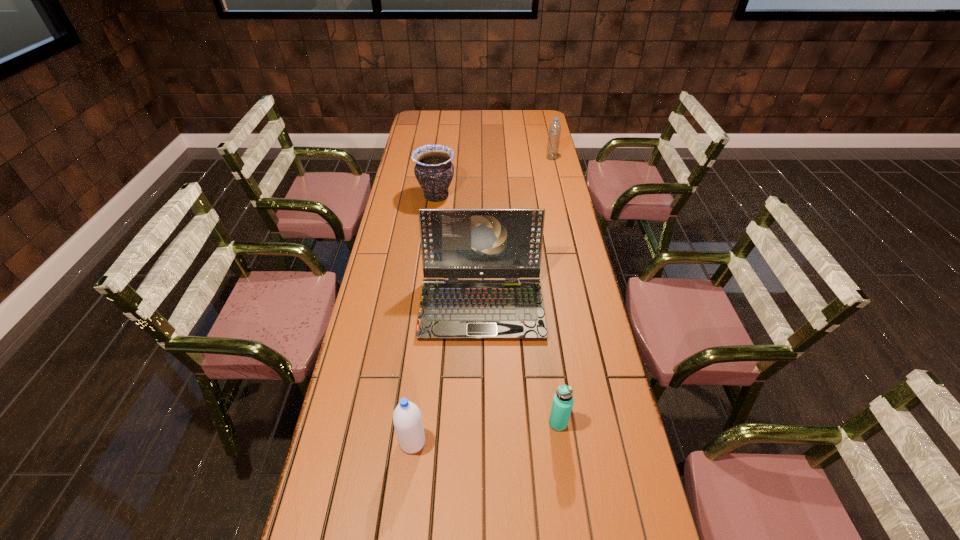
What are the coordinates of `vacant space located on the front handle of the pottery` in the screenshot? It's located at (534, 195).

You are a GUI agent. You are given a task and a screenshot of the screen. Output one action in this format:
    pyautogui.click(x=<x>, y=<y>)
    Task: Click on the vacant space located 0.240m on the right of the leftmost water bottle
    
    Given the screenshot: What is the action you would take?
    pyautogui.click(x=522, y=442)

Where is `free space located on the left of the shortest water bottle`? free space located on the left of the shortest water bottle is located at coordinates (483, 423).

Where is `object at the left edge`? object at the left edge is located at coordinates (434, 171).

Locate an element on the screen. The width and height of the screenshot is (960, 540). vacant area at the far edge of the desktop is located at coordinates (492, 129).

Where is `vacant space at the left edge of the desktop`? Image resolution: width=960 pixels, height=540 pixels. vacant space at the left edge of the desktop is located at coordinates (409, 145).

Locate an element on the screen. This screenshot has width=960, height=540. free space at the right edge is located at coordinates tap(641, 507).

Locate an element on the screen. The width and height of the screenshot is (960, 540). vacant space at the far left corner of the desktop is located at coordinates (427, 113).

The width and height of the screenshot is (960, 540). Find the location of `empty space that is in between the leftmost water bottle and the laptop computer`. empty space that is in between the leftmost water bottle and the laptop computer is located at coordinates (447, 373).

Where is `vacant area between the farthest object and the fourth nearest object`? Image resolution: width=960 pixels, height=540 pixels. vacant area between the farthest object and the fourth nearest object is located at coordinates (493, 177).